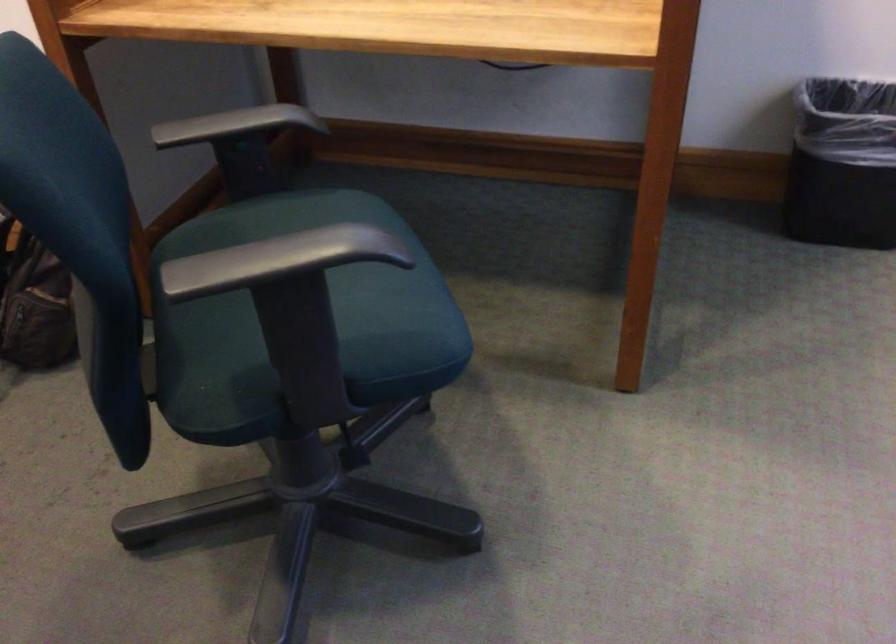
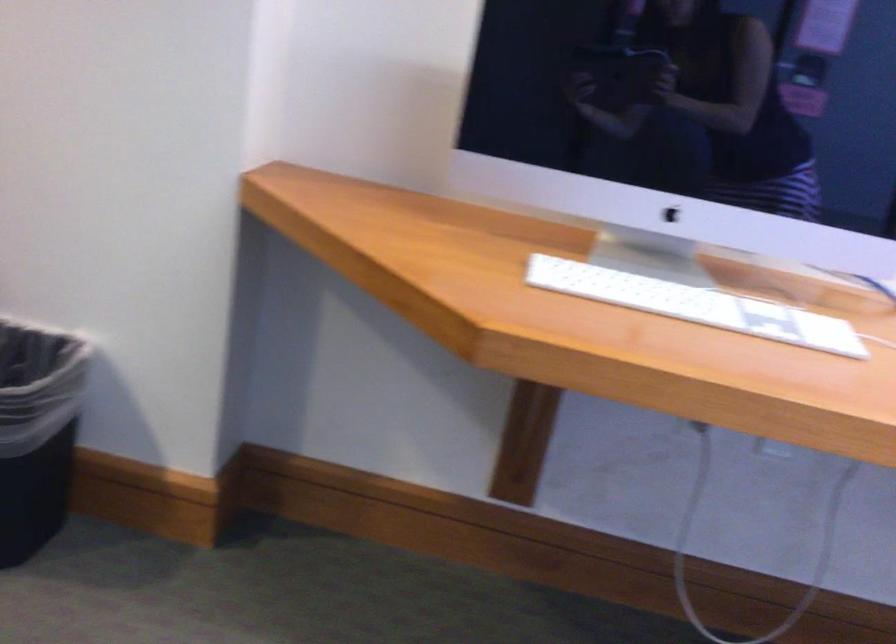
Question: The images are taken continuously from a first-person perspective. In which direction are you moving?

Choices:
 (A) Left
 (B) Right
 (C) Forward
 (D) Backward

Answer: (B)